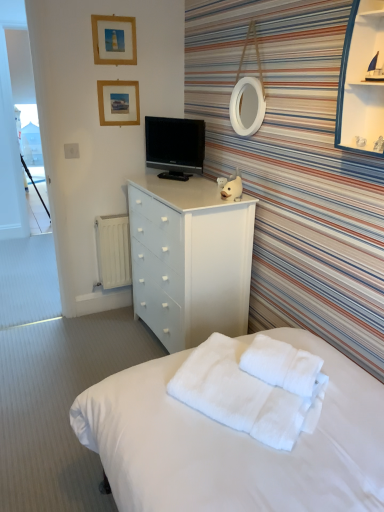
Question: From a real-world perspective, is wooden picture frame at upper center, the 1th picture frame ordered from the bottom, beneath white soft towel at lower center?

Choices:
 (A) yes
 (B) no

Answer: (B)

Question: Considering the relative sizes of wooden picture frame at upper center, the 1th picture frame ordered from the bottom, and white soft towel at lower center in the image provided, is wooden picture frame at upper center, the 1th picture frame ordered from the bottom, thinner than white soft towel at lower center?

Choices:
 (A) no
 (B) yes

Answer: (B)

Question: Is wooden picture frame at upper center, the 1th picture frame ordered from the bottom, located outside white soft towel at lower center?

Choices:
 (A) yes
 (B) no

Answer: (A)

Question: From the image's perspective, does wooden picture frame at upper center, placed as the second picture frame when sorted from top to bottom, appear lower than white soft towel at lower center?

Choices:
 (A) yes
 (B) no

Answer: (B)

Question: Does wooden picture frame at upper center, placed as the second picture frame when sorted from top to bottom, lie behind white soft towel at lower center?

Choices:
 (A) yes
 (B) no

Answer: (A)

Question: Are wooden picture frame at upper center, placed as the second picture frame when sorted from top to bottom, and white soft towel at lower center far apart?

Choices:
 (A) no
 (B) yes

Answer: (B)

Question: From a real-world perspective, is white matte chest of drawers at center under transparent glass cabinet at upper right?

Choices:
 (A) no
 (B) yes

Answer: (B)

Question: Is white matte chest of drawers at center in front of transparent glass cabinet at upper right?

Choices:
 (A) yes
 (B) no

Answer: (B)

Question: Are white matte chest of drawers at center and transparent glass cabinet at upper right making contact?

Choices:
 (A) yes
 (B) no

Answer: (B)

Question: Is white matte chest of drawers at center turned away from transparent glass cabinet at upper right?

Choices:
 (A) yes
 (B) no

Answer: (B)

Question: Is white matte chest of drawers at center at the right side of transparent glass cabinet at upper right?

Choices:
 (A) yes
 (B) no

Answer: (B)

Question: Is white matte chest of drawers at center shorter than transparent glass cabinet at upper right?

Choices:
 (A) no
 (B) yes

Answer: (A)

Question: Does wooden picture frame at upper center, placed as the second picture frame when sorted from top to bottom, lie behind transparent glass cabinet at upper right?

Choices:
 (A) yes
 (B) no

Answer: (A)